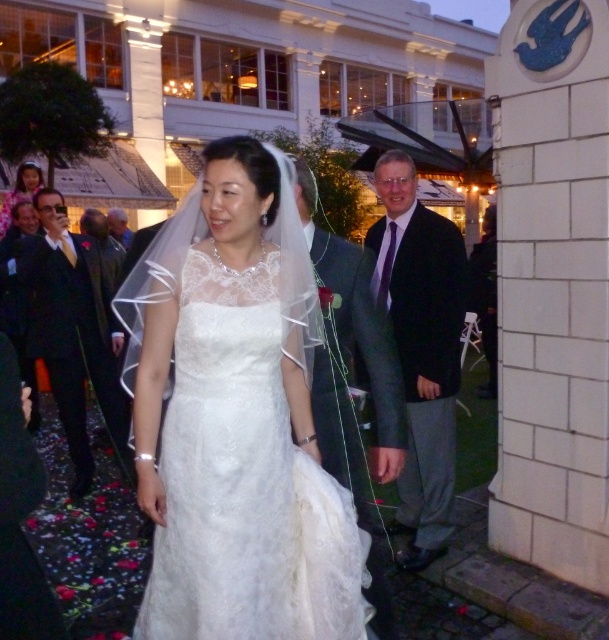
Question: Which object is farther from the camera taking this photo?

Choices:
 (A) matte black suit at right
 (B) gray wool suit at center
 (C) shiny black suit at left

Answer: (C)

Question: From the image, what is the correct spatial relationship of lace fabric dress at center in relation to matte black suit at right?

Choices:
 (A) right
 (B) left

Answer: (B)

Question: Based on their relative distances, which object is nearer to the dark gray suit at left?

Choices:
 (A) shiny black suit at left
 (B) lace fabric dress at center
 (C) matte black suit at right
 (D) gray wool suit at center

Answer: (A)

Question: Which object is the farthest from the matte white dress at upper left?

Choices:
 (A) shiny black suit at left
 (B) gray wool suit at center
 (C) matte black suit at right
 (D) lace fabric dress at center

Answer: (D)

Question: Is gray wool suit at center bigger than dark gray suit at left?

Choices:
 (A) yes
 (B) no

Answer: (A)

Question: Can you confirm if lace fabric dress at center is smaller than matte black suit at right?

Choices:
 (A) yes
 (B) no

Answer: (A)